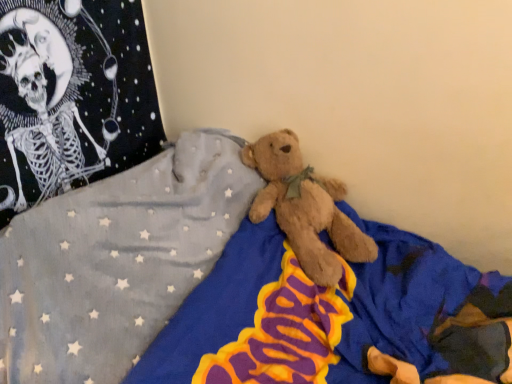
You are a GUI agent. You are given a task and a screenshot of the screen. Output one action in this format:
    pyautogui.click(x=<x>, y=<y>)
    Task: Click on the fuzzy brown teddy bear at upper left
    This screenshot has height=384, width=512.
    Given the screenshot: What is the action you would take?
    pyautogui.click(x=50, y=96)

This screenshot has width=512, height=384. What do you see at coordinates (50, 96) in the screenshot?
I see `fuzzy brown teddy bear at upper left` at bounding box center [50, 96].

Measure the distance between fuzzy brown teddy bear at upper left and camera.

36.93 inches.

What is the approximate width of soft plush bear at center?

soft plush bear at center is 36.99 inches wide.

Describe the element at coordinates (226, 289) in the screenshot. Image resolution: width=512 pixels, height=384 pixels. I see `soft plush bear at center` at that location.

Identify the location of soft plush bear at center. (226, 289).

In order to click on fuzzy brown teddy bear at upper left in this screenshot , I will do `click(50, 96)`.

Which is more to the left, soft plush bear at center or fuzzy brown teddy bear at upper left?

From the viewer's perspective, fuzzy brown teddy bear at upper left appears more on the left side.

Is soft plush bear at center positioned behind fuzzy brown teddy bear at upper left?

No, soft plush bear at center is closer to the camera.

Which point is more forward, (348, 336) or (104, 66)?

The point (348, 336) is more forward.

From the image's perspective, is soft plush bear at center beneath fuzzy brown teddy bear at upper left?

Yes, from the image's perspective, soft plush bear at center is beneath fuzzy brown teddy bear at upper left.

From a real-world perspective, is soft plush bear at center physically below fuzzy brown teddy bear at upper left?

Yes, from a real-world perspective, soft plush bear at center is below fuzzy brown teddy bear at upper left.

Considering the relative sizes of soft plush bear at center and fuzzy brown teddy bear at upper left in the image provided, is soft plush bear at center wider than fuzzy brown teddy bear at upper left?

Yes, soft plush bear at center is wider than fuzzy brown teddy bear at upper left.

Can you confirm if soft plush bear at center is taller than fuzzy brown teddy bear at upper left?

Yes.

Considering the sizes of soft plush bear at center and fuzzy brown teddy bear at upper left in the image, is soft plush bear at center bigger or smaller than fuzzy brown teddy bear at upper left?

Considering their sizes, soft plush bear at center takes up more space than fuzzy brown teddy bear at upper left.

Is soft plush bear at center inside the boundaries of fuzzy brown teddy bear at upper left, or outside?

soft plush bear at center is not inside fuzzy brown teddy bear at upper left, it's outside.

In the scene shown: Is soft plush bear at center beside fuzzy brown teddy bear at upper left?

soft plush bear at center and fuzzy brown teddy bear at upper left are clearly separated.

Is soft plush bear at center facing towards fuzzy brown teddy bear at upper left?

No, soft plush bear at center does not turn towards fuzzy brown teddy bear at upper left.

Can you tell me how much soft plush bear at center and fuzzy brown teddy bear at upper left differ in facing direction?

There is a 91.3-degree angle between the facing directions of soft plush bear at center and fuzzy brown teddy bear at upper left.

Identify the location of toy behind the soft plush bear at center. (50, 96).

Does fuzzy brown teddy bear at upper left appear on the right side of soft plush bear at center?

In fact, fuzzy brown teddy bear at upper left is to the left of soft plush bear at center.

Is fuzzy brown teddy bear at upper left in front of or behind soft plush bear at center in the image?

Clearly, fuzzy brown teddy bear at upper left is behind soft plush bear at center.

Which point is more distant from viewer, [67,178] or [42,212]?

The point [67,178] is farther.

From the image's perspective, is fuzzy brown teddy bear at upper left positioned above or below soft plush bear at center?

Clearly, from the image's perspective, fuzzy brown teddy bear at upper left is above soft plush bear at center.

From a real-world perspective, who is located higher, fuzzy brown teddy bear at upper left or soft plush bear at center?

fuzzy brown teddy bear at upper left.

Can you confirm if fuzzy brown teddy bear at upper left is thinner than soft plush bear at center?

Correct, the width of fuzzy brown teddy bear at upper left is less than that of soft plush bear at center.

Considering the sizes of fuzzy brown teddy bear at upper left and soft plush bear at center in the image, is fuzzy brown teddy bear at upper left taller or shorter than soft plush bear at center?

Clearly, fuzzy brown teddy bear at upper left is shorter compared to soft plush bear at center.

Considering the relative sizes of fuzzy brown teddy bear at upper left and soft plush bear at center in the image provided, is fuzzy brown teddy bear at upper left smaller than soft plush bear at center?

Correct, fuzzy brown teddy bear at upper left occupies less space than soft plush bear at center.

Does fuzzy brown teddy bear at upper left contain soft plush bear at center?

No, fuzzy brown teddy bear at upper left does not contain soft plush bear at center.

Is fuzzy brown teddy bear at upper left positioned far away from soft plush bear at center?

fuzzy brown teddy bear at upper left is near soft plush bear at center, not far away.

Is fuzzy brown teddy bear at upper left facing towards soft plush bear at center?

Yes, fuzzy brown teddy bear at upper left is facing soft plush bear at center.

This screenshot has height=384, width=512. Find the location of `toy that appears behind the soft plush bear at center`. toy that appears behind the soft plush bear at center is located at coordinates (50, 96).

Find the location of a particular element. The image size is (512, 384). bed on the right of fuzzy brown teddy bear at upper left is located at coordinates (226, 289).

Find the location of a particular element. toy above the soft plush bear at center (from the image's perspective) is located at coordinates (50, 96).